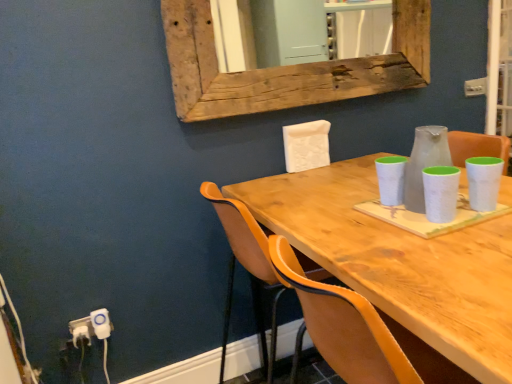
Question: Is white plastic electric outlet at lower left, which is the 2th electric outlet in right-to-left order, wider or thinner than wooden table at center?

Choices:
 (A) thin
 (B) wide

Answer: (A)

Question: From their relative heights in the image, would you say white plastic electric outlet at lower left, which is the 2th electric outlet in right-to-left order, is taller or shorter than wooden table at center?

Choices:
 (A) tall
 (B) short

Answer: (B)

Question: Which object is the farthest from the white plastic electric outlet at lower left, which is counted as the 2th electric outlet, starting from the left?

Choices:
 (A) white plastic electric outlet at lower left, arranged as the 1th electric outlet when viewed from the left
 (B) wooden table at center
 (C) orange leather chair at center
 (D) weathered wood mirror at upper center

Answer: (D)

Question: Which of these objects is positioned closest to the orange leather chair at center?

Choices:
 (A) weathered wood mirror at upper center
 (B) white plastic electric outlet at lower left, arranged as the 1th electric outlet when viewed from the left
 (C) wooden table at center
 (D) white plastic electric outlet at lower left, which is counted as the 2th electric outlet, starting from the left

Answer: (C)